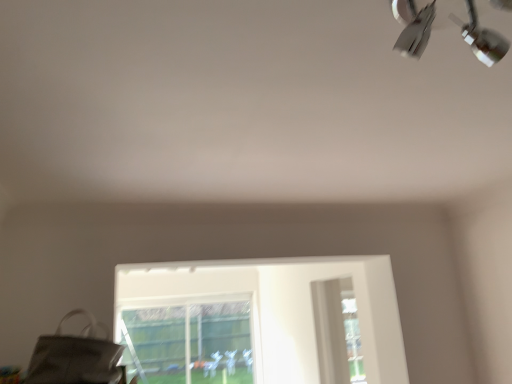
Question: Is matte gray messenger bag at lower left taller than transparent glass bay window at lower center?

Choices:
 (A) no
 (B) yes

Answer: (A)

Question: Considering the relative sizes of matte gray messenger bag at lower left and transparent glass bay window at lower center in the image provided, is matte gray messenger bag at lower left smaller than transparent glass bay window at lower center?

Choices:
 (A) no
 (B) yes

Answer: (B)

Question: From the image's perspective, does matte gray messenger bag at lower left appear lower than transparent glass bay window at lower center?

Choices:
 (A) no
 (B) yes

Answer: (A)

Question: Can you confirm if matte gray messenger bag at lower left is shorter than transparent glass bay window at lower center?

Choices:
 (A) no
 (B) yes

Answer: (B)

Question: From a real-world perspective, is matte gray messenger bag at lower left physically below transparent glass bay window at lower center?

Choices:
 (A) yes
 (B) no

Answer: (B)

Question: Do you think metallic silver lamp at upper right is within matte gray messenger bag at lower left, or outside of it?

Choices:
 (A) inside
 (B) outside

Answer: (B)

Question: From a real-world perspective, is metallic silver lamp at upper right above or below matte gray messenger bag at lower left?

Choices:
 (A) above
 (B) below

Answer: (A)

Question: Would you say metallic silver lamp at upper right is to the left or to the right of matte gray messenger bag at lower left in the picture?

Choices:
 (A) left
 (B) right

Answer: (B)

Question: Based on their sizes in the image, would you say metallic silver lamp at upper right is bigger or smaller than matte gray messenger bag at lower left?

Choices:
 (A) big
 (B) small

Answer: (B)

Question: Considering the positions of point (160, 319) and point (474, 46), is point (160, 319) closer or farther from the camera than point (474, 46)?

Choices:
 (A) farther
 (B) closer

Answer: (A)

Question: From the image's perspective, is transparent glass bay window at lower center positioned above or below metallic silver lamp at upper right?

Choices:
 (A) below
 (B) above

Answer: (A)

Question: Considering the positions of transparent glass bay window at lower center and metallic silver lamp at upper right in the image, is transparent glass bay window at lower center bigger or smaller than metallic silver lamp at upper right?

Choices:
 (A) small
 (B) big

Answer: (B)

Question: Is transparent glass bay window at lower center inside or outside of metallic silver lamp at upper right?

Choices:
 (A) outside
 (B) inside

Answer: (A)

Question: From the image's perspective, relative to metallic silver lamp at upper right, is matte gray messenger bag at lower left above or below?

Choices:
 (A) below
 (B) above

Answer: (A)

Question: In terms of width, does matte gray messenger bag at lower left look wider or thinner when compared to metallic silver lamp at upper right?

Choices:
 (A) wide
 (B) thin

Answer: (A)